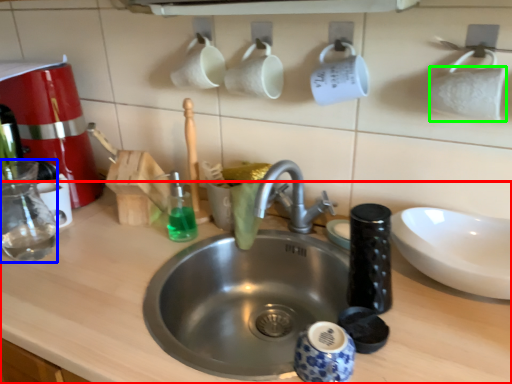
Question: Considering the real-world distances, which object is closest to counter top (highlighted by a red box)? bottle (highlighted by a blue box) or toilet paper (highlighted by a green box).

Choices:
 (A) bottle
 (B) toilet paper

Answer: (A)